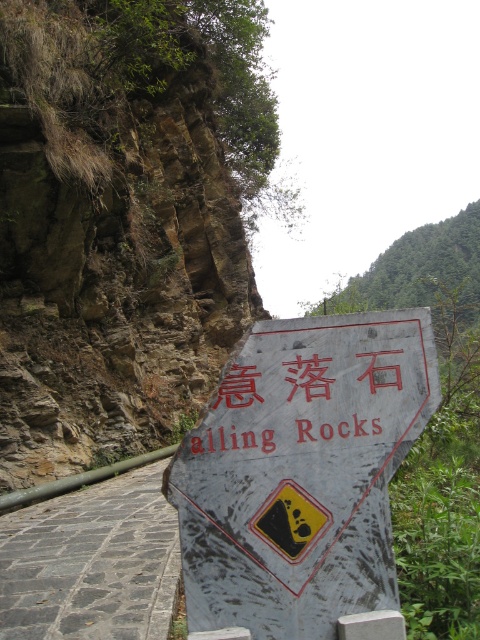
Who is lower down, weathered gray sign at center or red painted sign at center?

Positioned lower is weathered gray sign at center.

Is point (388, 480) closer to camera compared to point (210, 429)?

That is False.

Find the location of a particular element. Image resolution: width=480 pixels, height=640 pixels. weathered gray sign at center is located at coordinates (300, 472).

How much distance is there between gray stone path at lower left and red painted sign at center?

They are 9.67 feet apart.

What do you see at coordinates (92, 563) in the screenshot?
I see `gray stone path at lower left` at bounding box center [92, 563].

Is point (146, 609) behind point (384, 365)?

Yes, it is behind point (384, 365).

This screenshot has height=640, width=480. Identify the location of gray stone path at lower left. (92, 563).

Which is in front, point (206, 582) or point (144, 513)?

Positioned in front is point (206, 582).

Is point (297, 346) closer to viewer compared to point (0, 536)?

Yes, it is.

Is point (288, 497) positioned in front of point (157, 552)?

Yes, point (288, 497) is in front of point (157, 552).

Image resolution: width=480 pixels, height=640 pixels. I want to click on weathered gray sign at center, so click(x=300, y=472).